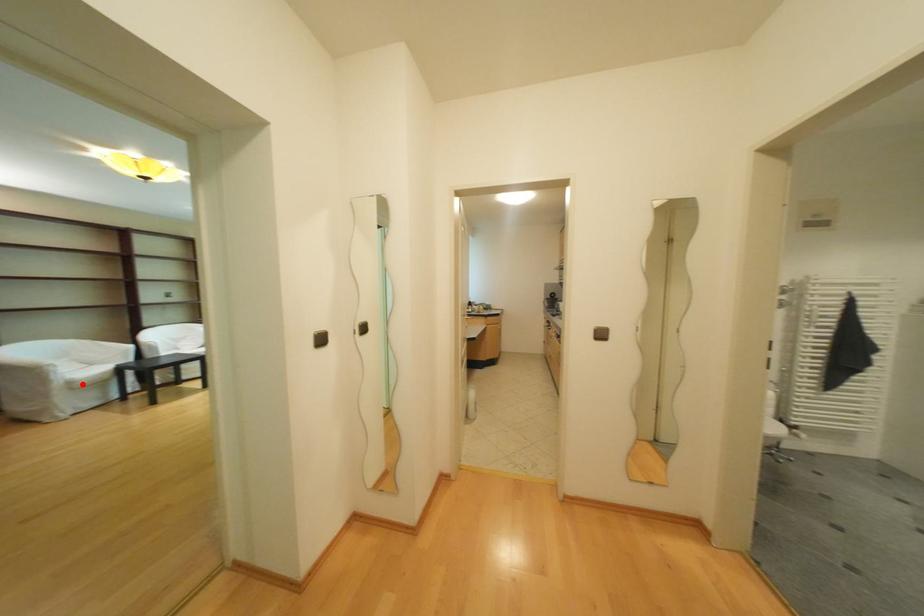
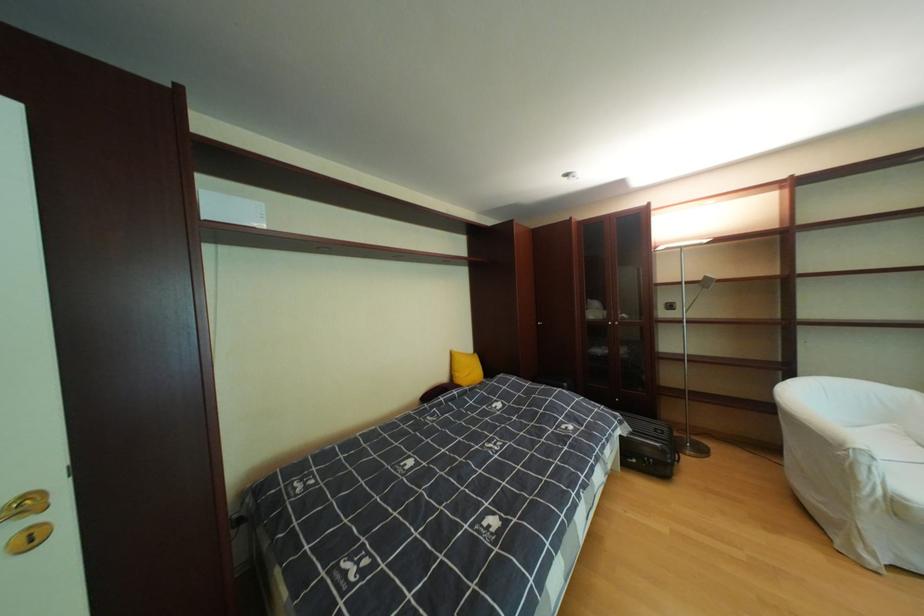
Question: I am providing you with two images of the same scene from different viewpoints. In image1, a red point is highlighted. Considering the same 3D point in image2, which of the following is correct?

Choices:
 (A) It is closer
 (B) It is farther

Answer: (A)